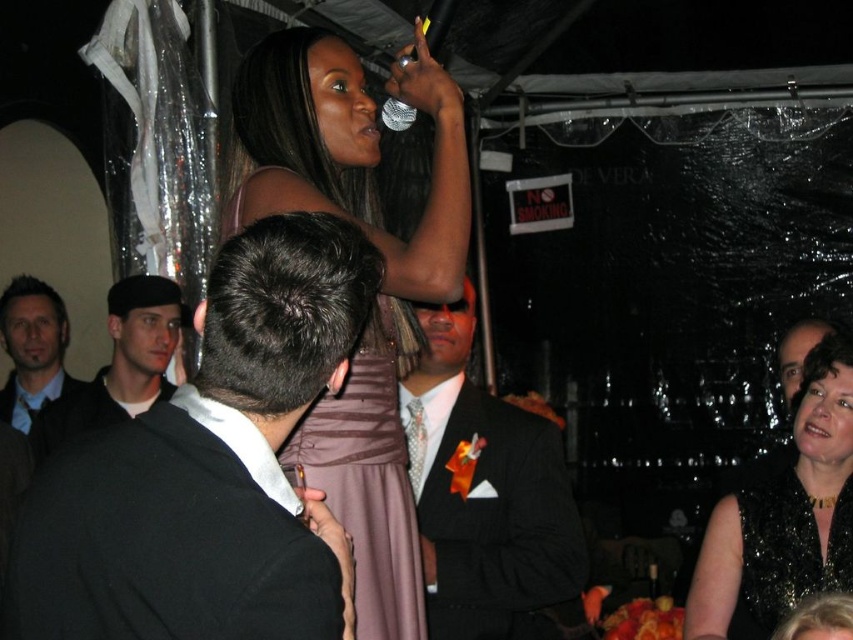
Question: Which object is the closest to the matte black suit at left?

Choices:
 (A) black sequined dress at lower right
 (B) matte purple dress at upper center
 (C) black sequined dress at upper center
 (D) smooth black suit at center

Answer: (B)

Question: Can you confirm if black satin suit at center is positioned below shiny black suit at center?

Choices:
 (A) no
 (B) yes

Answer: (A)

Question: Where is black matte cap at left located in relation to matte black suit at left in the image?

Choices:
 (A) below
 (B) above

Answer: (B)

Question: Which of the following is the farthest from the observer?

Choices:
 (A) (779, 348)
 (B) (769, 634)

Answer: (A)

Question: Is shiny black suit at center behind black sequined dress at lower right?

Choices:
 (A) yes
 (B) no

Answer: (B)

Question: Which object appears closest to the camera in this image?

Choices:
 (A) black sequined dress at lower right
 (B) black satin suit at center
 (C) shiny black suit at center
 (D) black sequined dress at upper center

Answer: (B)